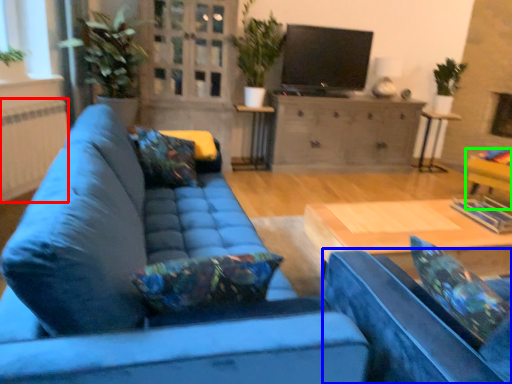
Question: Based on their relative distances, which object is farther from radiator (highlighted by a red box)? Choose from armchair (highlighted by a blue box) and armchair (highlighted by a green box).

Choices:
 (A) armchair
 (B) armchair

Answer: (B)